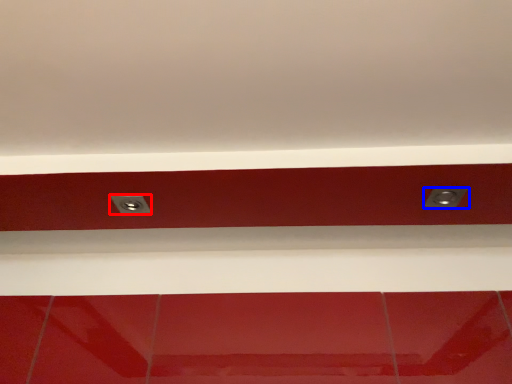
Question: Which of the following is the farthest to the observer, power plugs and sockets (highlighted by a red box) or power plugs and sockets (highlighted by a blue box)?

Choices:
 (A) power plugs and sockets
 (B) power plugs and sockets

Answer: (A)